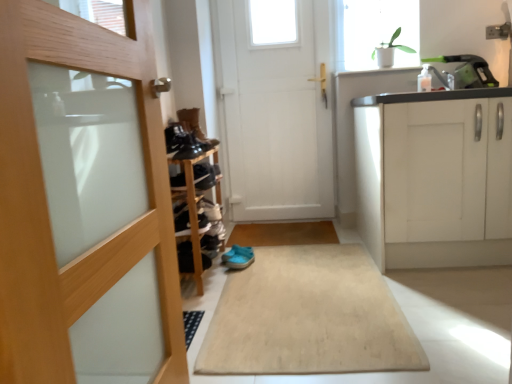
I want to click on vacant space underneath beige carpet at center (from a real-world perspective), so click(x=303, y=288).